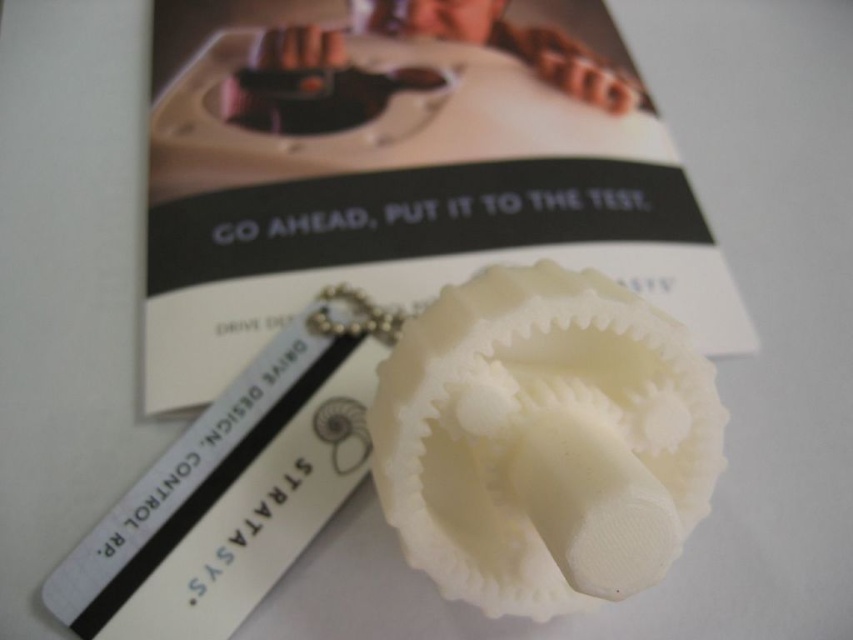
Question: Does white matte gear at center appear on the left side of white plastic bookmark at center?

Choices:
 (A) no
 (B) yes

Answer: (A)

Question: Which point is farther from the camera taking this photo?

Choices:
 (A) (154, 476)
 (B) (706, 348)

Answer: (B)

Question: Does white matte gear at center appear on the left side of white plastic bookmark at center?

Choices:
 (A) yes
 (B) no

Answer: (B)

Question: Is white matte gear at center in front of white plastic bookmark at center?

Choices:
 (A) yes
 (B) no

Answer: (B)